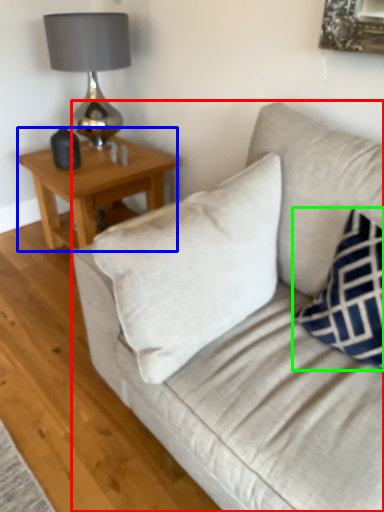
Question: Considering the real-world distances, which object is farthest from studio couch (highlighted by a red box)? table (highlighted by a blue box) or pillow (highlighted by a green box)?

Choices:
 (A) table
 (B) pillow

Answer: (A)